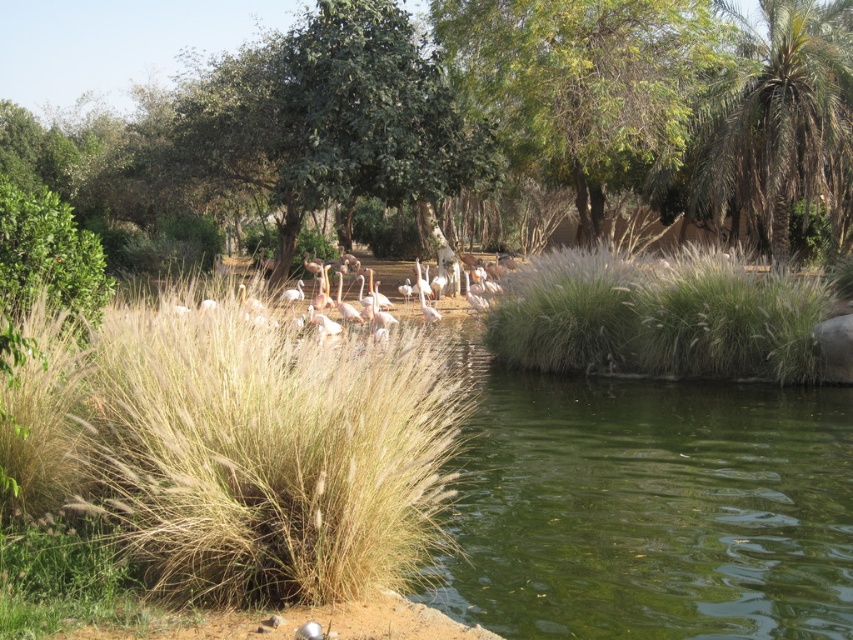
You are a bird flying over the serene natural scene with flamingos. You want to land on the closest green leafy tree. Which tree should you choose between the green leafy tree at center and the green leafy tree at upper center?

The green leafy tree at center is closer to you than the green leafy tree at upper center, so you should choose the green leafy tree at center to land on.